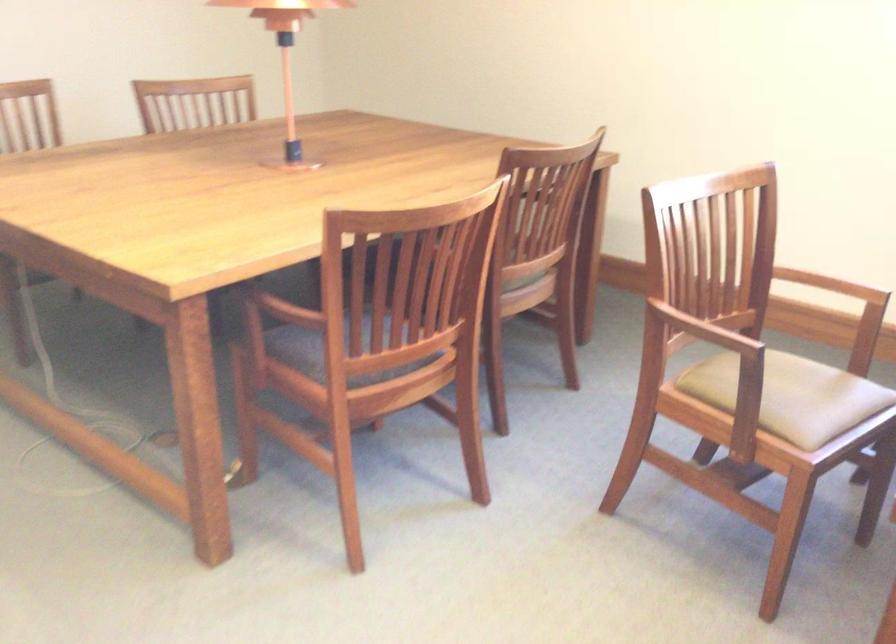
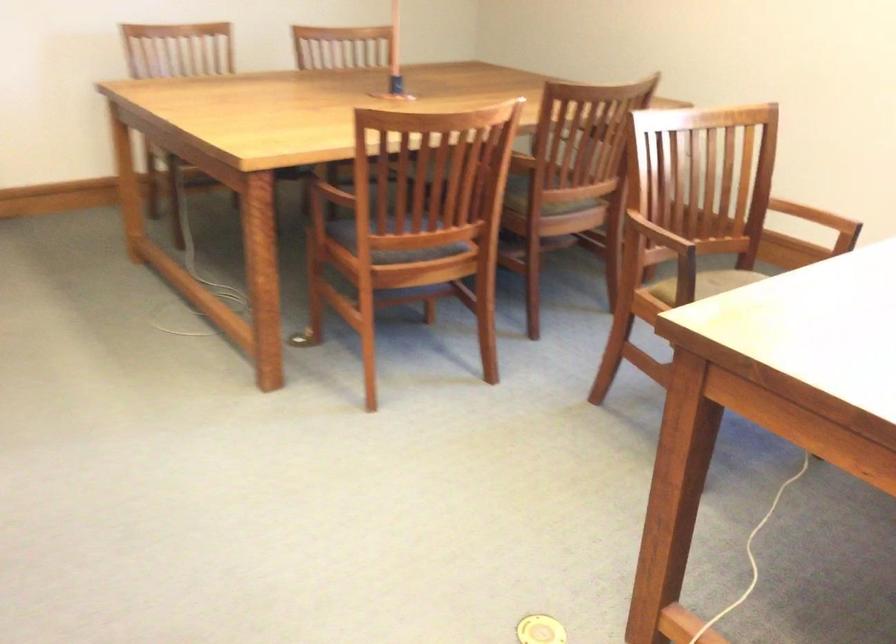
Question: The images are taken continuously from a first-person perspective. In which direction is your viewpoint rotating?

Choices:
 (A) Left
 (B) Right
 (C) Up
 (D) Down

Answer: (A)